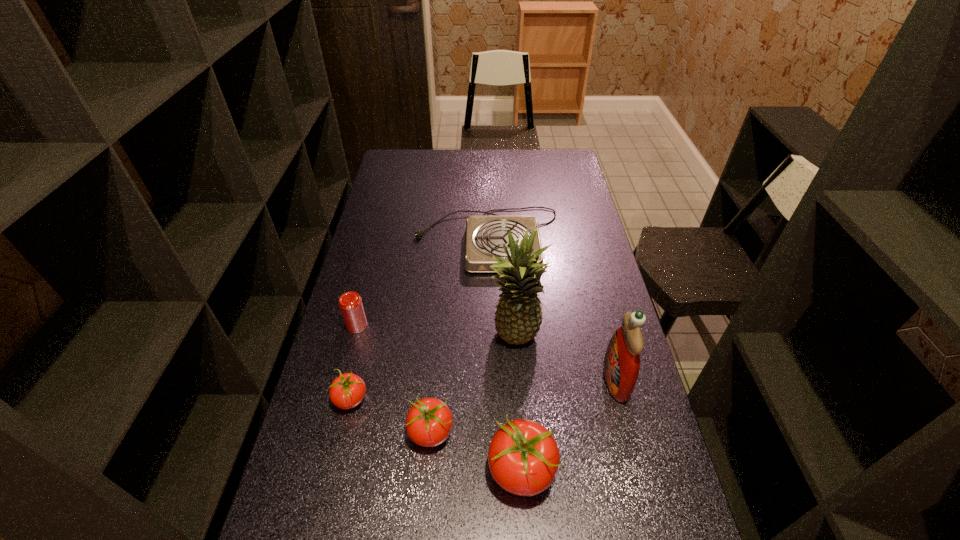
Locate an element on the screen. object that is positioned at the near edge is located at coordinates (523, 457).

This screenshot has height=540, width=960. What are the coordinates of `tomato at the left edge` in the screenshot? It's located at (347, 391).

Where is `beer can that is at the left edge`? beer can that is at the left edge is located at coordinates (350, 303).

Find the location of a particular element. detergent that is positioned at the right edge is located at coordinates (621, 364).

Where is `hotplate present at the right edge`? The image size is (960, 540). hotplate present at the right edge is located at coordinates (485, 235).

Locate an element on the screen. free space at the far edge is located at coordinates (457, 151).

The height and width of the screenshot is (540, 960). In the image, there is a desktop. Find the location of `vacant space at the left edge`. vacant space at the left edge is located at coordinates (394, 222).

The image size is (960, 540). What are the coordinates of `vacant space at the right edge of the desktop` in the screenshot? It's located at (576, 215).

Locate an element on the screen. free space at the far left corner is located at coordinates (400, 157).

The width and height of the screenshot is (960, 540). In the image, there is a desktop. In order to click on vacant space at the far right corner in this screenshot , I will do `click(569, 153)`.